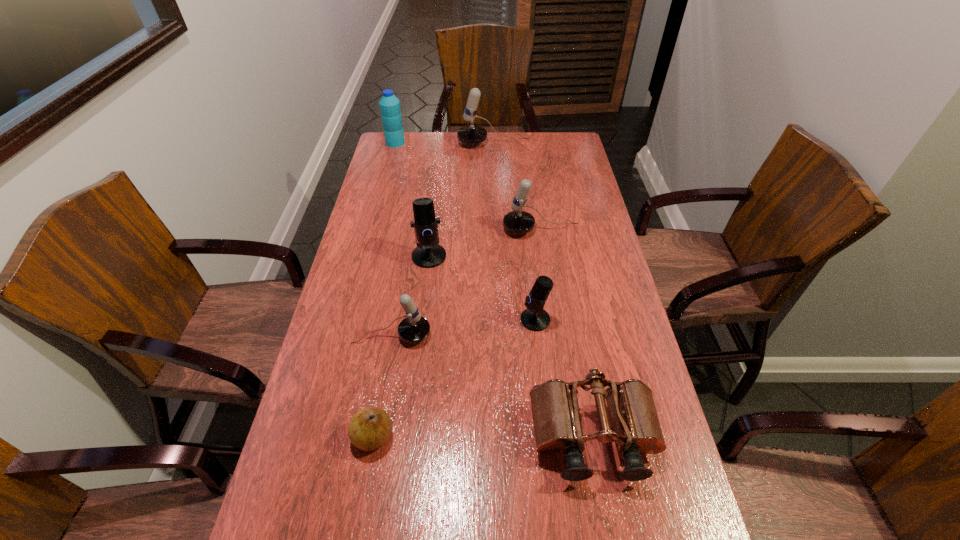
You are a GUI agent. You are given a task and a screenshot of the screen. Output one action in this format:
    pyautogui.click(x=<x>, y=<y>)
    Task: Click on the vacant space positioned on the stand of the nearer black microphone
    
    Given the screenshot: What is the action you would take?
    pyautogui.click(x=475, y=320)

Locate an element on the screen. Image resolution: width=960 pixels, height=540 pixels. vacant region located 0.300m on the back of the brown pear is located at coordinates (394, 320).

Locate an element on the screen. microphone located in the far edge section of the desktop is located at coordinates (471, 134).

You are a GUI agent. You are given a task and a screenshot of the screen. Output one action in this format:
    pyautogui.click(x=<x>, y=<y>)
    Task: Click on the water bottle positioned at the far edge
    This screenshot has height=540, width=960.
    Given the screenshot: What is the action you would take?
    pyautogui.click(x=390, y=109)

Identify the location of water bottle at the left edge. The image size is (960, 540). (390, 109).

Find the location of a particular element. The width and height of the screenshot is (960, 540). microphone at the left edge is located at coordinates (414, 328).

Find the location of `pear that is at the left edge`. pear that is at the left edge is located at coordinates (370, 428).

In order to click on microphone that is positioned at the right edge in this screenshot , I will do `click(517, 221)`.

Identify the location of binoculars at the right edge. Image resolution: width=960 pixels, height=540 pixels. (555, 409).

The width and height of the screenshot is (960, 540). In order to click on object located in the far left corner section of the desktop in this screenshot , I will do `click(390, 109)`.